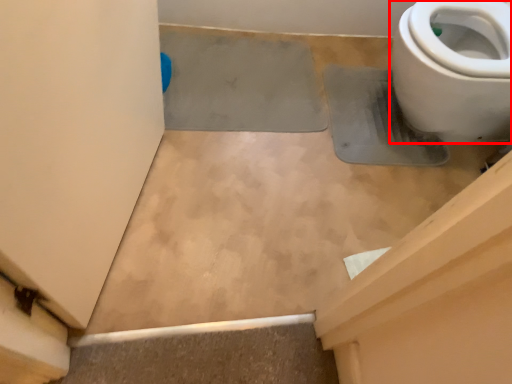
Question: In this image, where is toilet (annotated by the red box) located relative to concrete?

Choices:
 (A) right
 (B) left

Answer: (A)